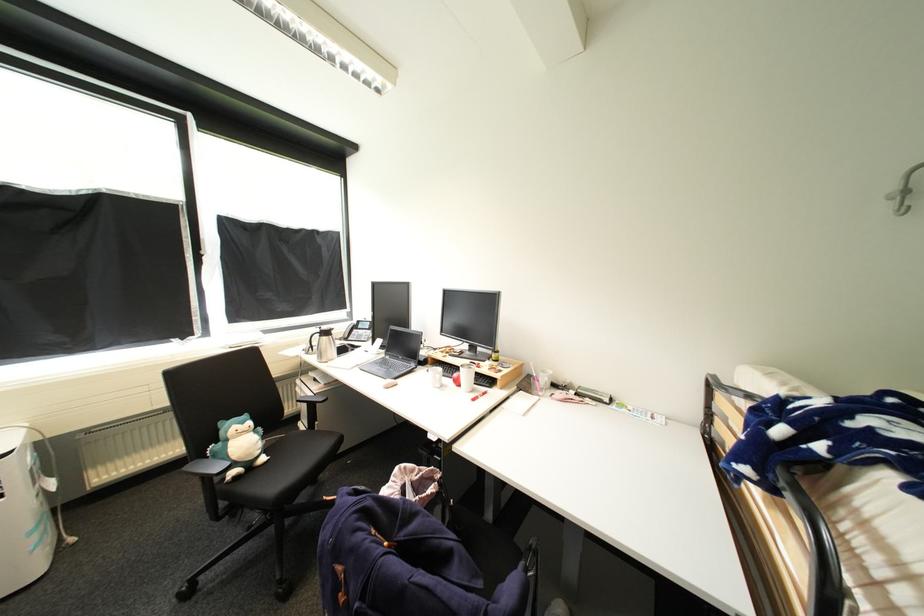
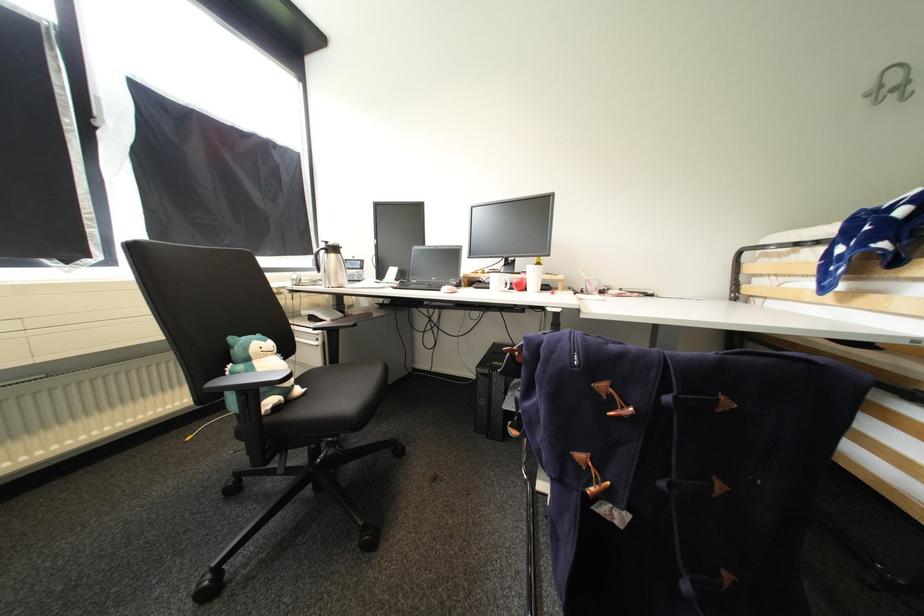
Question: The images are taken continuously from a first-person perspective. In which direction is your viewpoint rotating?

Choices:
 (A) Left
 (B) Right
 (C) Up
 (D) Down

Answer: (B)